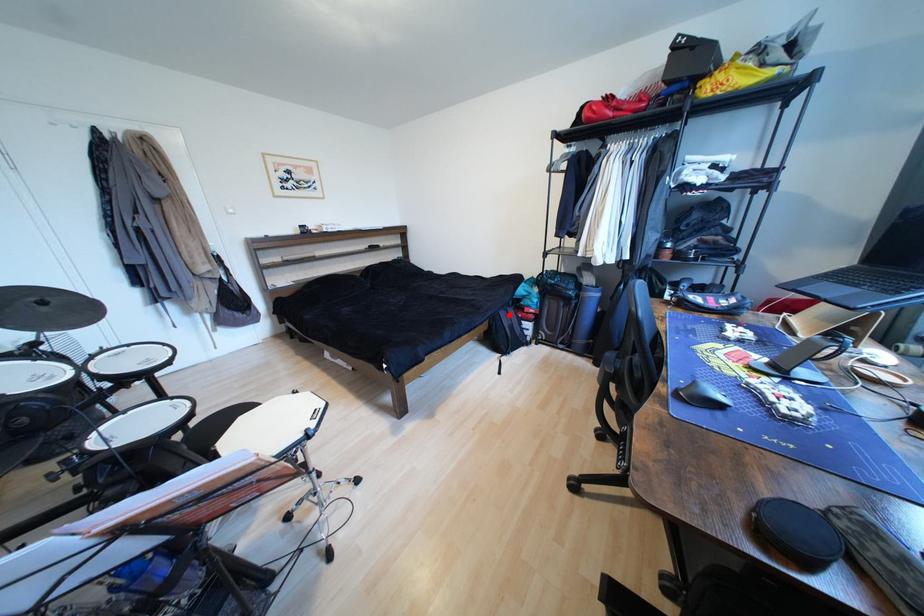
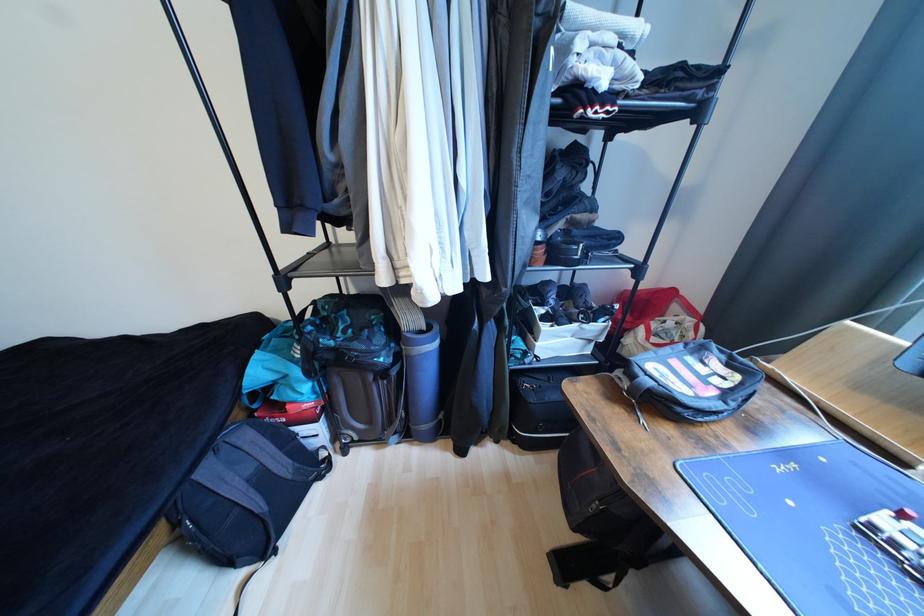
The point at the highlighted location is marked in the first image. Where is the corresponding point in the second image?

(215, 472)